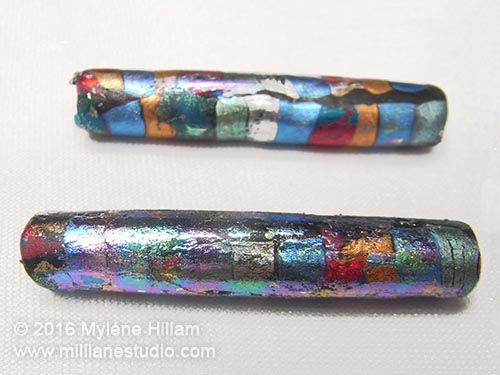
Where is `white tablecloth`? This screenshot has height=375, width=500. white tablecloth is located at coordinates (325, 350), (187, 179).